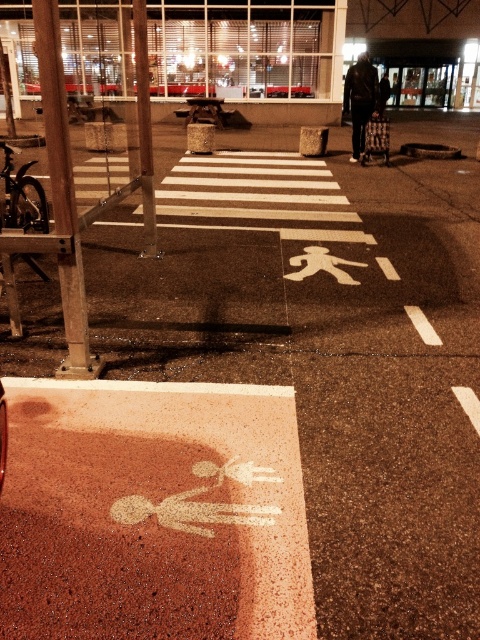
Can you confirm if brushed metal pole at left is taller than dark brown leather jacket at center?

Incorrect, brushed metal pole at left's height is not larger of dark brown leather jacket at center's.

Consider the image. Can you confirm if brushed metal pole at left is wider than dark brown leather jacket at center?

No, brushed metal pole at left is not wider than dark brown leather jacket at center.

Between point (78, 369) and point (361, 70), which one is positioned behind?

The point (361, 70) is behind.

This screenshot has height=640, width=480. Identify the location of brushed metal pole at left. (62, 193).

Can you confirm if brushed metal pole at left is shorter than metallic pole at center?

Indeed, brushed metal pole at left has a lesser height compared to metallic pole at center.

Can you confirm if brushed metal pole at left is taller than metallic pole at center?

In fact, brushed metal pole at left may be shorter than metallic pole at center.

Is point (73, 282) in front of point (135, 6)?

That is True.

This screenshot has width=480, height=640. Identify the location of brushed metal pole at left. (62, 193).

Does metallic pole at center appear on the right side of dark brown leather jacket at center?

In fact, metallic pole at center is to the left of dark brown leather jacket at center.

Between metallic pole at center and dark brown leather jacket at center, which one appears on the right side from the viewer's perspective?

Positioned to the right is dark brown leather jacket at center.

Who is more forward, (x=145, y=60) or (x=350, y=161)?

Point (x=145, y=60) is more forward.

Find the location of a particular element. The height and width of the screenshot is (640, 480). metallic pole at center is located at coordinates (144, 131).